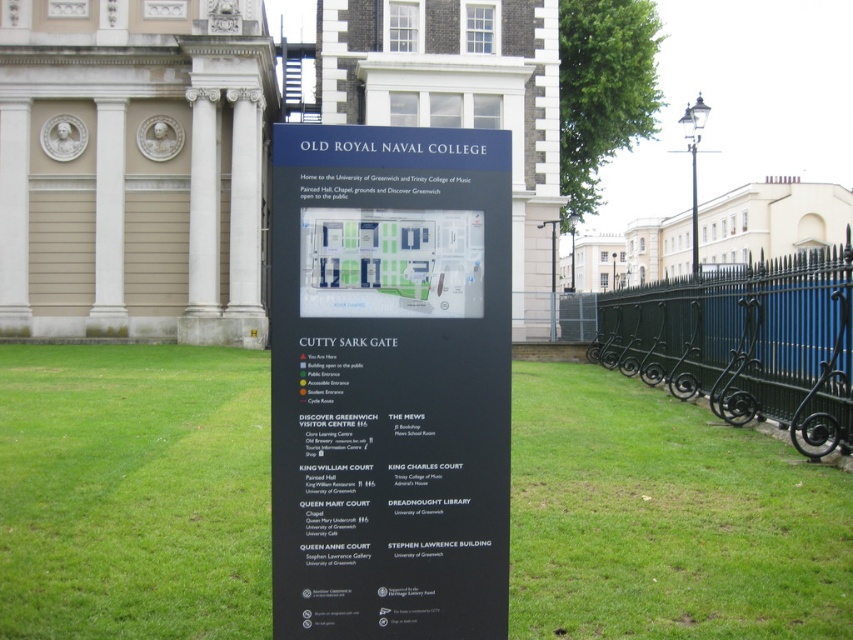
Can you confirm if green grass at center is taller than black matte sign at center?

In fact, green grass at center may be shorter than black matte sign at center.

Can you confirm if green grass at center is positioned above black matte sign at center?

No, green grass at center is not above black matte sign at center.

I want to click on green grass at center, so click(665, 518).

Which of these two, green grass at center or green wrought iron fence at right, stands taller?

green wrought iron fence at right is taller.

Between green grass at center and green wrought iron fence at right, which one is positioned higher?

green wrought iron fence at right

Between point (157, 353) and point (788, 273), which one is positioned behind?

Point (157, 353)

At what (x,y) coordinates should I click in order to perform the action: click on green grass at center. Please return your answer as a coordinate pair (x, y). Looking at the image, I should click on (665, 518).

Is black matte sign at center further to the viewer compared to green wrought iron fence at right?

No, it is not.

Does black matte sign at center have a lesser width compared to green wrought iron fence at right?

Yes, black matte sign at center is thinner than green wrought iron fence at right.

The height and width of the screenshot is (640, 853). Describe the element at coordinates (389, 381) in the screenshot. I see `black matte sign at center` at that location.

The image size is (853, 640). Identify the location of black matte sign at center. (389, 381).